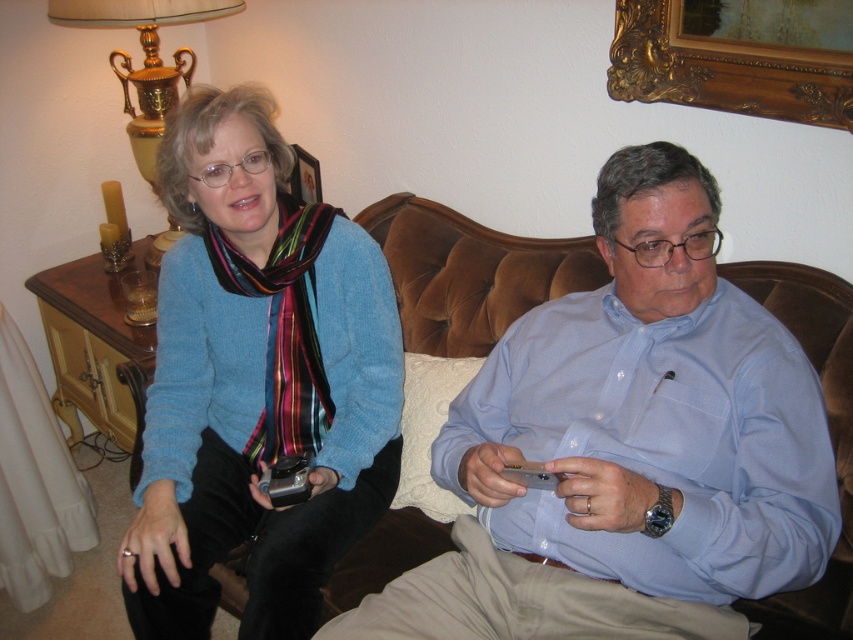
You are a furniture delivery person who needs to move a new sofa that is 2 meters wide into this living room. The current brown velvet couch at center is in the way. Can the new sofa fit through the doorway if the wooden picture frame at upper center is 1 meter wide?

The brown velvet couch at center is wider than the wooden picture frame at upper center. Since the wooden picture frame is 1 meter wide, the brown velvet couch must be wider than 1 meter. The new sofa is 2 meters wide, which is larger than the current couch. Therefore, if the current couch can fit through the doorway, the new sofa might not because it is even wider. However, without knowing the exact doorway width, we can only infer that the new sofa is larger than the existing couch, so it may not fit.

You are a guest in this living room and want to sit on the brown velvet couch at center. Where should you sit if you want to be on the opposite side of the matte blue sweater at left?

You should sit on the right side of the brown velvet couch at center because the matte blue sweater at left is on the left side, so the opposite side would be the right side.

You are a visitor in this living room and want to place a new shelf that is 1 meter tall. The shelf must be placed either on the brown velvet couch at center or the wooden picture frame at upper center. Based on their heights, which object can the shelf be placed on?

The brown velvet couch at center is taller than the wooden picture frame at upper center, so the shelf can be placed on the brown velvet couch at center since it is tall enough to support the shelf.